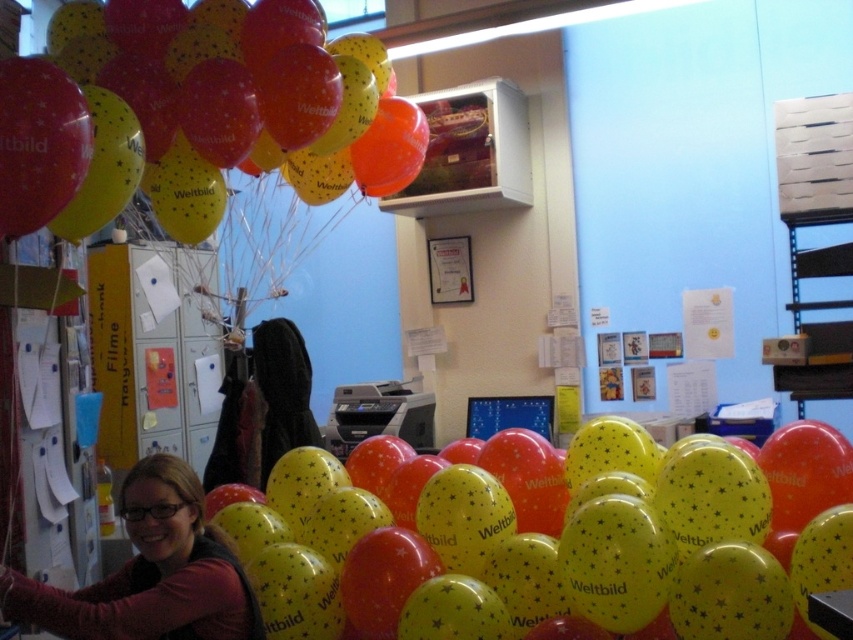
Based on the photo, does yellow glossy balloon at center come in front of matte black sweater at lower left?

No, yellow glossy balloon at center is behind matte black sweater at lower left.

Between yellow glossy balloon at center and matte black sweater at lower left, which one appears on the right side from the viewer's perspective?

From the viewer's perspective, yellow glossy balloon at center appears more on the right side.

Who is more forward, (648, 566) or (148, 589)?

Point (148, 589) is more forward.

Where is `yellow glossy balloon at center`? The height and width of the screenshot is (640, 853). yellow glossy balloon at center is located at coordinates point(560,540).

Between matte yellow balloon at upper left and matte black sweater at lower left, which one appears on the right side from the viewer's perspective?

Positioned to the right is matte yellow balloon at upper left.

Can you confirm if matte yellow balloon at upper left is wider than matte black sweater at lower left?

Yes.

I want to click on matte yellow balloon at upper left, so click(186, 100).

Who is taller, yellow glossy balloon at center or matte yellow balloon at upper left?

With more height is matte yellow balloon at upper left.

Does point (828, 477) come behind point (68, 164)?

That is True.

Is point (763, 557) positioned in front of point (194, 51)?

Yes.

At what (x,y) coordinates should I click in order to perform the action: click on yellow glossy balloon at center. Please return your answer as a coordinate pair (x, y). The image size is (853, 640). Looking at the image, I should click on (560, 540).